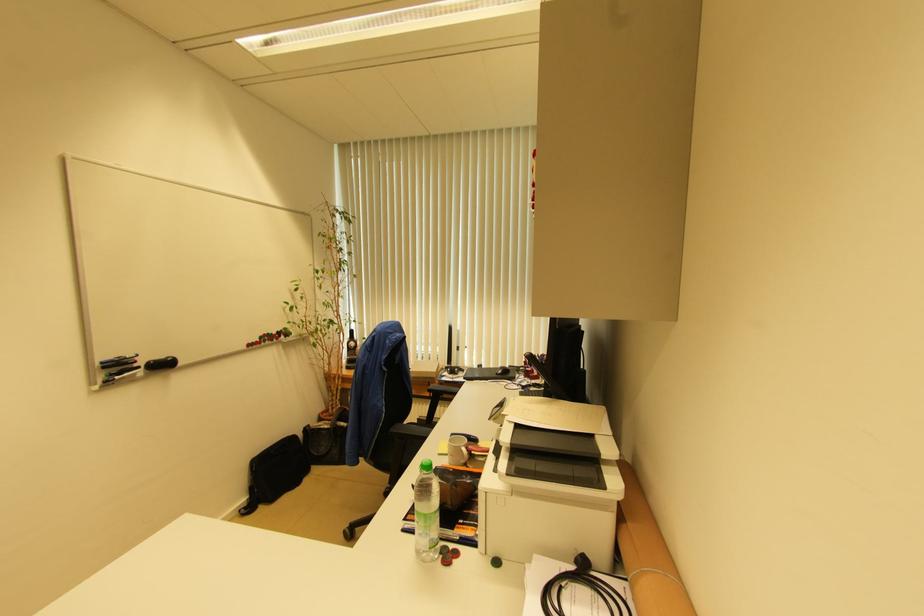
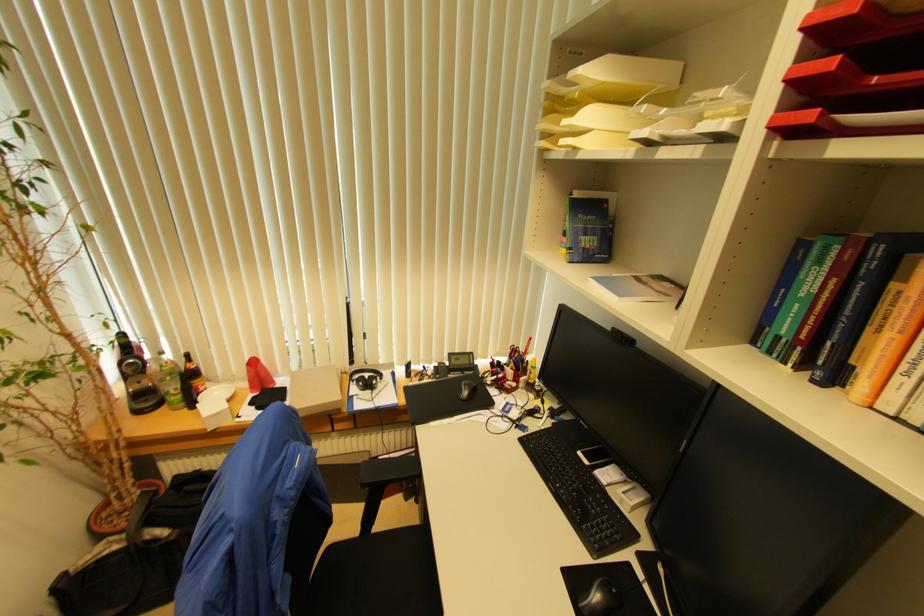
In the second image, find the point that corresponds to point (502, 374) in the first image.

(467, 395)